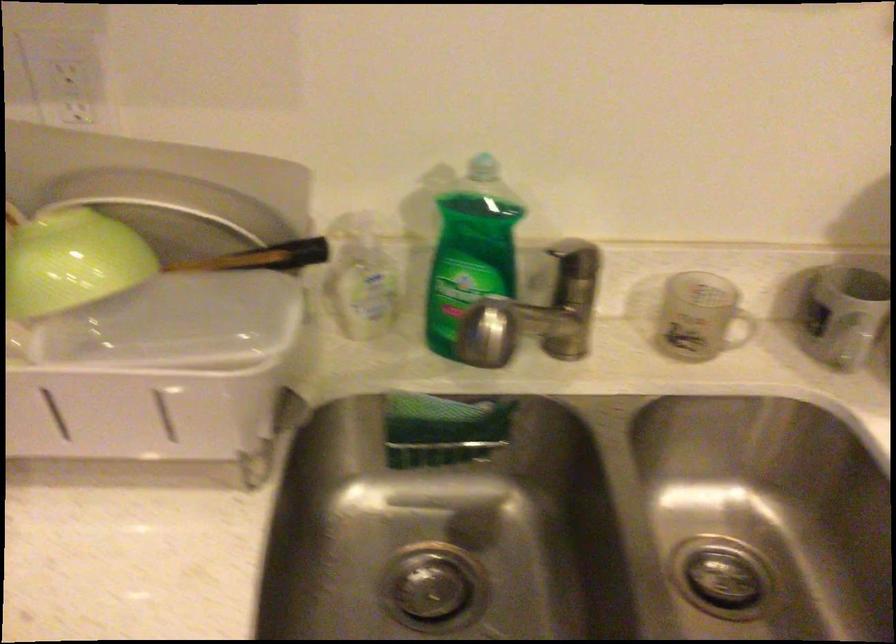
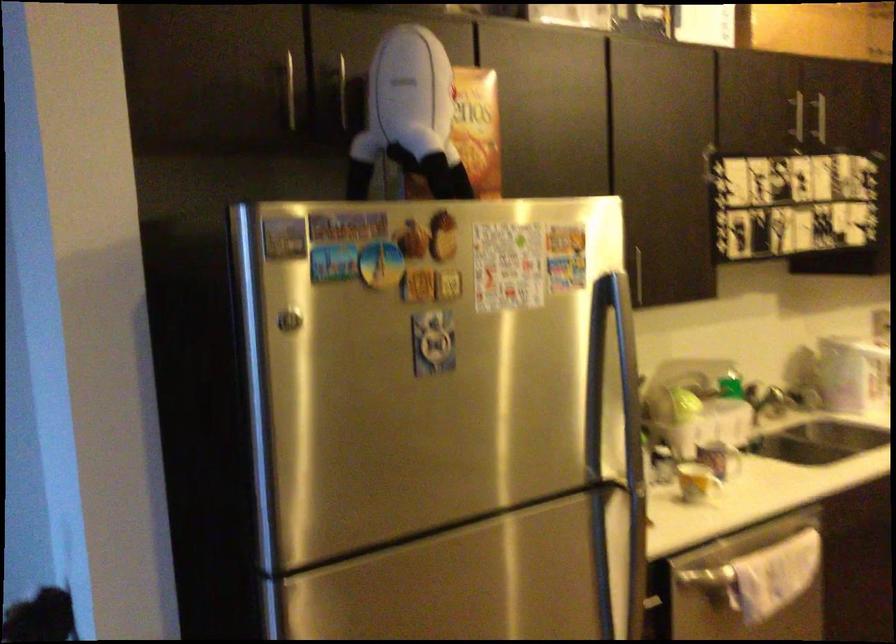
Question: I am providing you with two images of the same scene from different viewpoints. After the viewpoint changes to image2, which objects are now occluded?

Choices:
 (A) utensil handle
 (B) white ceramic mug
 (C) dry erase marker
 (D) white kettle handle

Answer: (A)